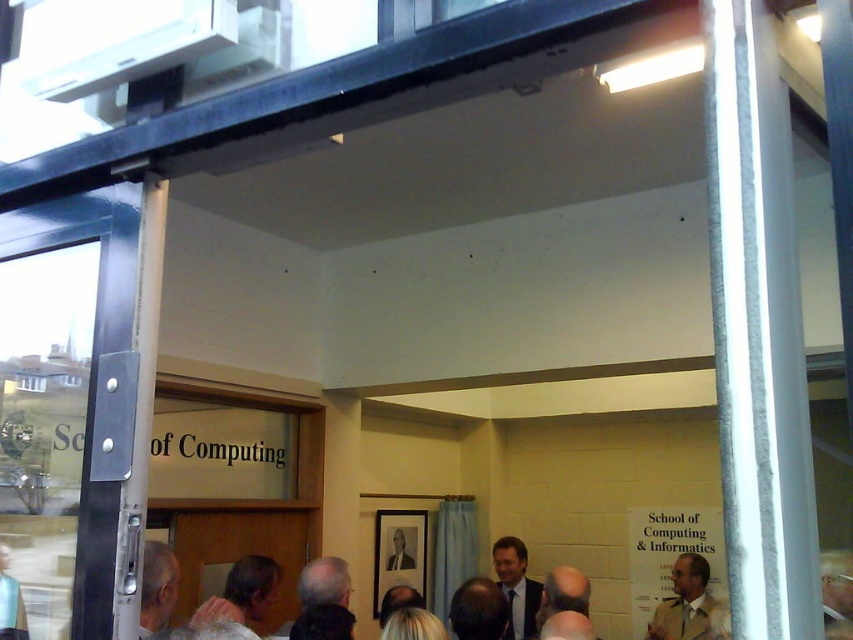
Question: Is transparent glass door at left above dark gray suit at lower left?

Choices:
 (A) no
 (B) yes

Answer: (B)

Question: Is smooth bald head at lower center wider than matte black portrait at center?

Choices:
 (A) yes
 (B) no

Answer: (B)

Question: Which object appears farthest from the camera in this image?

Choices:
 (A) matte black suit at center
 (B) light brown leather jacket at lower right
 (C) matte black portrait at center
 (D) gray hair at lower left

Answer: (C)

Question: Is matte black suit at center wider than light brown leather jacket at lower right?

Choices:
 (A) yes
 (B) no

Answer: (B)

Question: Among these points, which one is farthest from the camera?

Choices:
 (A) (149, 625)
 (B) (685, 570)

Answer: (B)

Question: Considering the real-world distances, which object is closest to the dark gray suit at lower left?

Choices:
 (A) matte black suit at center
 (B) gray hair at center

Answer: (B)